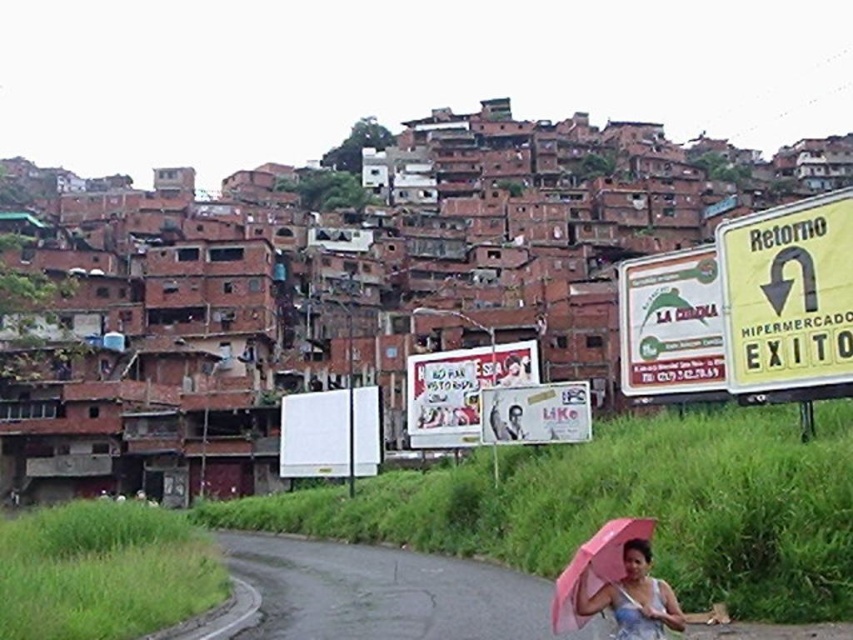
Question: Does brown brick houses at upper left have a greater width compared to pink matte umbrella at lower right?

Choices:
 (A) no
 (B) yes

Answer: (B)

Question: Which of the following is the closest to the observer?

Choices:
 (A) (694, 477)
 (B) (618, 525)

Answer: (B)

Question: Which object is closer to the camera taking this photo?

Choices:
 (A) brown brick houses at upper left
 (B) pink matte umbrella at lower right

Answer: (B)

Question: Is brown brick houses at upper left closer to camera compared to pink matte umbrella at lower right?

Choices:
 (A) no
 (B) yes

Answer: (A)

Question: Can you confirm if brown brick houses at upper left is thinner than pink matte umbrella at lower right?

Choices:
 (A) no
 (B) yes

Answer: (A)